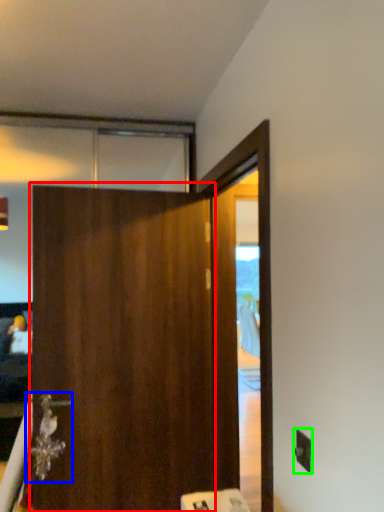
Question: Estimate the real-world distances between objects in this image. Which object is farther from barn door (highlighted by a red box), door handle (highlighted by a blue box) or electric outlet (highlighted by a green box)?

Choices:
 (A) door handle
 (B) electric outlet

Answer: (B)